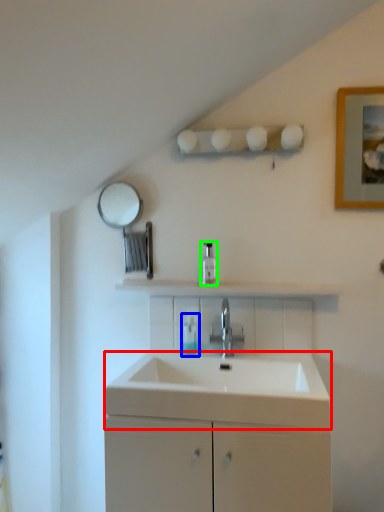
Question: Considering the real-world distances, which object is closest to counter top (highlighted by a red box)? toiletry (highlighted by a blue box) or soap dispenser (highlighted by a green box).

Choices:
 (A) toiletry
 (B) soap dispenser

Answer: (A)